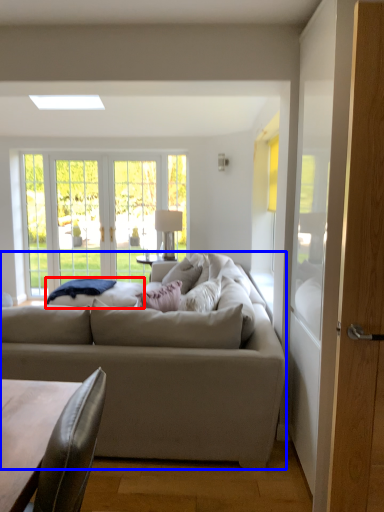
Question: Which object appears farthest to the camera in this image, wide (highlighted by a red box) or studio couch (highlighted by a blue box)?

Choices:
 (A) wide
 (B) studio couch

Answer: (A)